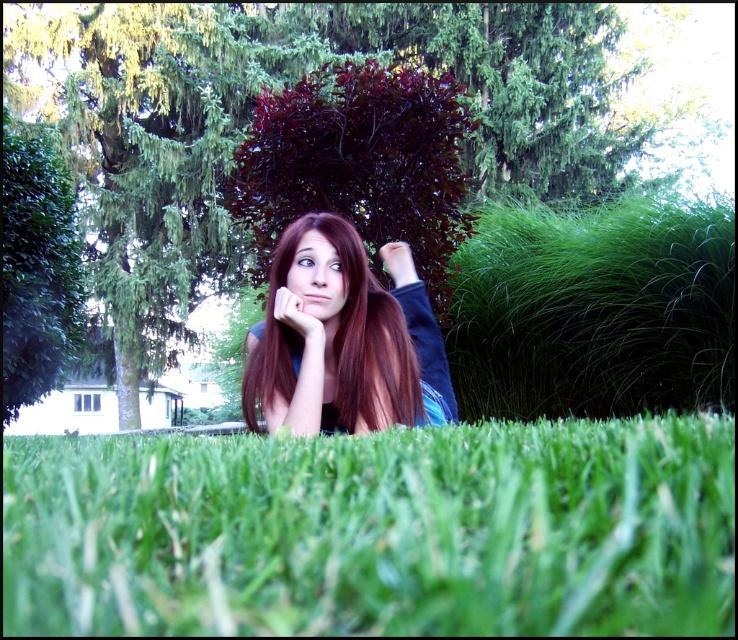
You are a photographer trying to capture the perfect shot of the shiny brown hair at center and the matte black hand at upper center. Which object should you zoom in on to ensure both are clearly visible in the frame?

The shiny brown hair at center is larger in size than the matte black hand at upper center, so you should zoom in on the smaller object, the matte black hand at upper center, to ensure both are clearly visible in the frame.

Based on the photo, you are a photographer trying to capture a closeup of the shiny brown hair at center. Since the green grass at lower center is blocking the view, can you adjust your position to get a clear shot?

The green grass at lower center is larger in size than shiny brown hair at center, so moving closer or adjusting the angle might help reduce the obstruction caused by the grass.